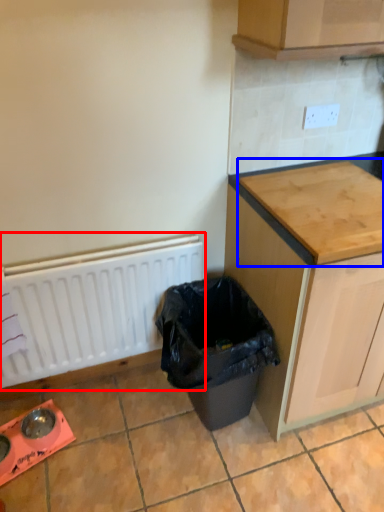
Question: Which object is closer to the camera taking this photo, radiator (highlighted by a red box) or countertop (highlighted by a blue box)?

Choices:
 (A) radiator
 (B) countertop

Answer: (B)